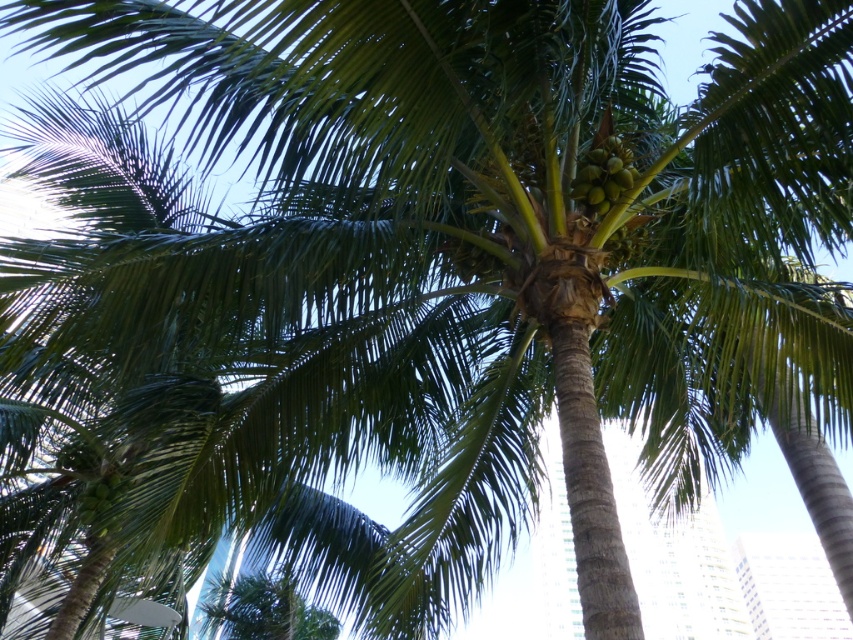
Is green matte coconuts at upper center shorter than green matte coconuts at upper left?

No, green matte coconuts at upper center is not shorter than green matte coconuts at upper left.

Is point (631, 154) positioned before point (102, 490)?

Yes, it is.

The image size is (853, 640). What are the coordinates of `green matte coconuts at upper center` in the screenshot? It's located at (602, 176).